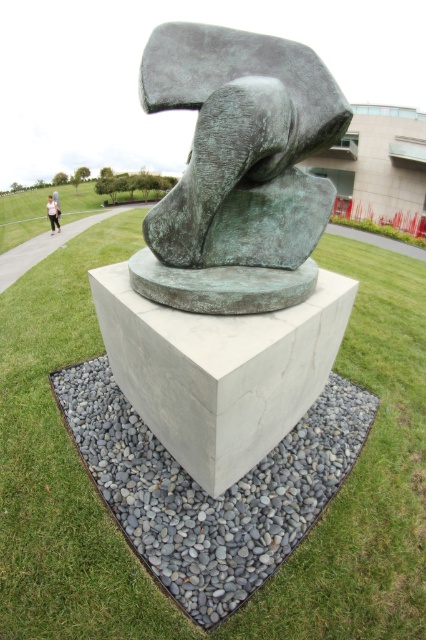
You are a photographer setting up a shot of the sculpture. You have a 1.5 meter wide light pink fabric backdrop that you want to place at the lower left corner of the image. The green grass at center currently occupies a wider area than the light pink fabric at lower left. Will the backdrop fit in the space where the light pink fabric is placed?

The green grass at center is wider than the light pink fabric at lower left, so the 1.5 meter wide light pink fabric backdrop will fit in the space where the light pink fabric is placed since the grass area is wider.